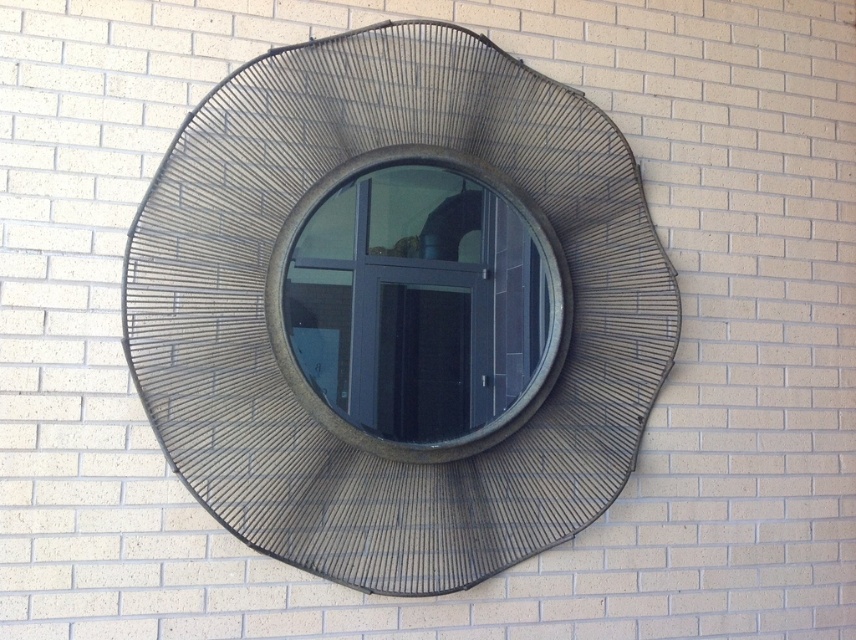
Question: Which of the following is the closest to the observer?

Choices:
 (A) (402, 301)
 (B) (195, 168)

Answer: (B)

Question: Is metallic wire mesh at center wider than matte glass window at center?

Choices:
 (A) no
 (B) yes

Answer: (B)

Question: Among these objects, which one is nearest to the camera?

Choices:
 (A) matte glass window at center
 (B) metallic wire mesh at center

Answer: (B)

Question: Is metallic wire mesh at center above matte glass window at center?

Choices:
 (A) yes
 (B) no

Answer: (A)

Question: Does metallic wire mesh at center have a smaller size compared to matte glass window at center?

Choices:
 (A) no
 (B) yes

Answer: (A)